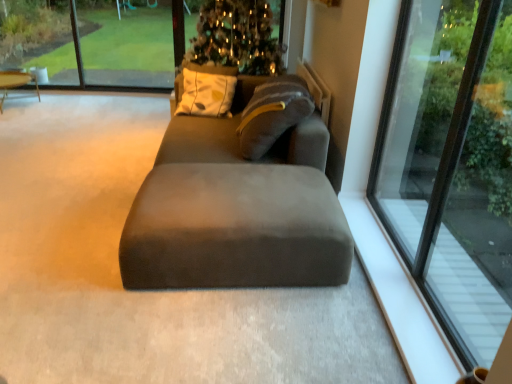
Question: Considering the relative positions of suede-like gray studio couch at center and green glass window at upper left, the second window screen when ordered from right to left, in the image provided, is suede-like gray studio couch at center to the left of green glass window at upper left, the second window screen when ordered from right to left, from the viewer's perspective?

Choices:
 (A) no
 (B) yes

Answer: (A)

Question: Considering the relative sizes of suede-like gray studio couch at center and green glass window at upper left, which is the 1th window screen in left-to-right order, in the image provided, is suede-like gray studio couch at center smaller than green glass window at upper left, which is the 1th window screen in left-to-right order,?

Choices:
 (A) yes
 (B) no

Answer: (B)

Question: From the image's perspective, is suede-like gray studio couch at center over green glass window at upper left, the second window screen when ordered from right to left?

Choices:
 (A) yes
 (B) no

Answer: (B)

Question: Is suede-like gray studio couch at center not near green glass window at upper left, which is the 1th window screen in left-to-right order?

Choices:
 (A) yes
 (B) no

Answer: (A)

Question: Does suede-like gray studio couch at center have a greater height compared to green glass window at upper left, the second window screen when ordered from right to left?

Choices:
 (A) no
 (B) yes

Answer: (A)

Question: Are suede-like gray studio couch at center and green glass window at upper left, which is the 1th window screen in left-to-right order, beside each other?

Choices:
 (A) no
 (B) yes

Answer: (A)

Question: Is clear glass window at upper center, acting as the 2th window screen starting from the left, placed right next to transparent glass window at right?

Choices:
 (A) no
 (B) yes

Answer: (A)

Question: From the image's perspective, does clear glass window at upper center, which ranks as the 1th window screen in right-to-left order, appear higher than transparent glass window at right?

Choices:
 (A) no
 (B) yes

Answer: (B)

Question: Considering the relative sizes of clear glass window at upper center, which ranks as the 1th window screen in right-to-left order, and transparent glass window at right in the image provided, is clear glass window at upper center, which ranks as the 1th window screen in right-to-left order, thinner than transparent glass window at right?

Choices:
 (A) no
 (B) yes

Answer: (A)

Question: Considering the relative sizes of clear glass window at upper center, which ranks as the 1th window screen in right-to-left order, and transparent glass window at right in the image provided, is clear glass window at upper center, which ranks as the 1th window screen in right-to-left order, taller than transparent glass window at right?

Choices:
 (A) yes
 (B) no

Answer: (B)

Question: Is clear glass window at upper center, which ranks as the 1th window screen in right-to-left order, bigger than transparent glass window at right?

Choices:
 (A) no
 (B) yes

Answer: (B)

Question: Could you tell me if clear glass window at upper center, which ranks as the 1th window screen in right-to-left order, is facing transparent glass window at right?

Choices:
 (A) no
 (B) yes

Answer: (B)

Question: From the image's perspective, is green glass window at upper left, the second window screen when ordered from right to left, over suede-like gray studio couch at center?

Choices:
 (A) no
 (B) yes

Answer: (B)